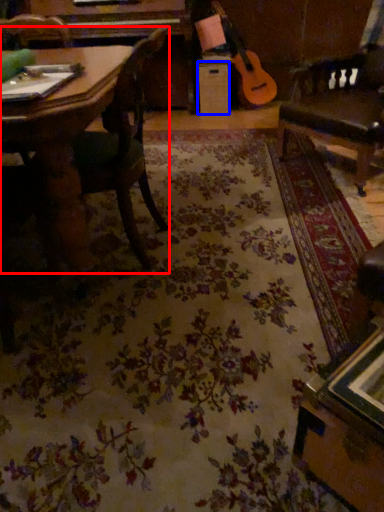
Question: Which object is further to the camera taking this photo, chair (highlighted by a red box) or drawer (highlighted by a blue box)?

Choices:
 (A) chair
 (B) drawer

Answer: (B)